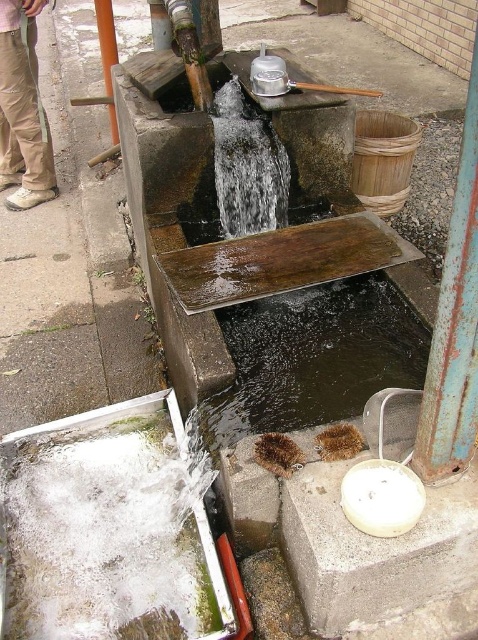
Question: Can you confirm if clear water at center is positioned to the left of khaki pants at left?

Choices:
 (A) no
 (B) yes

Answer: (A)

Question: Which point is farther to the camera?

Choices:
 (A) (117, 140)
 (B) (436, 353)
 (C) (26, 104)

Answer: (A)

Question: Considering the real-world distances, which object is closest to the brown textured water at center?

Choices:
 (A) khaki pants at left
 (B) smooth orange pole at upper left
 (C) clear water at center
 (D) rusty metal pole at right

Answer: (D)

Question: Is brown textured water at center to the left of khaki pants at left from the viewer's perspective?

Choices:
 (A) yes
 (B) no

Answer: (B)

Question: Which of the following is the farthest from the observer?

Choices:
 (A) (x=275, y=355)
 (B) (x=1, y=86)
 (C) (x=109, y=113)
 (D) (x=250, y=220)

Answer: (C)

Question: Is brown textured water at center below khaki pants at left?

Choices:
 (A) no
 (B) yes

Answer: (B)